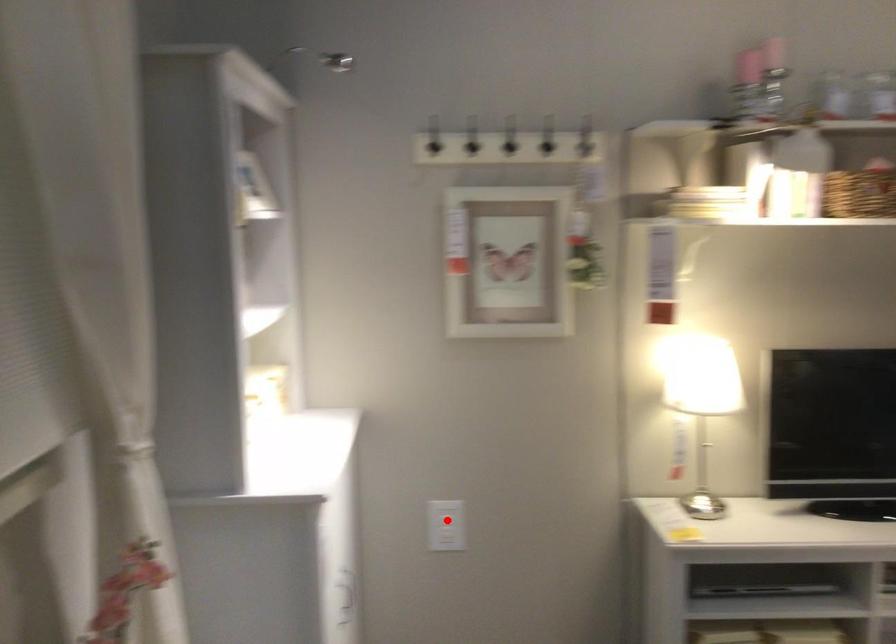
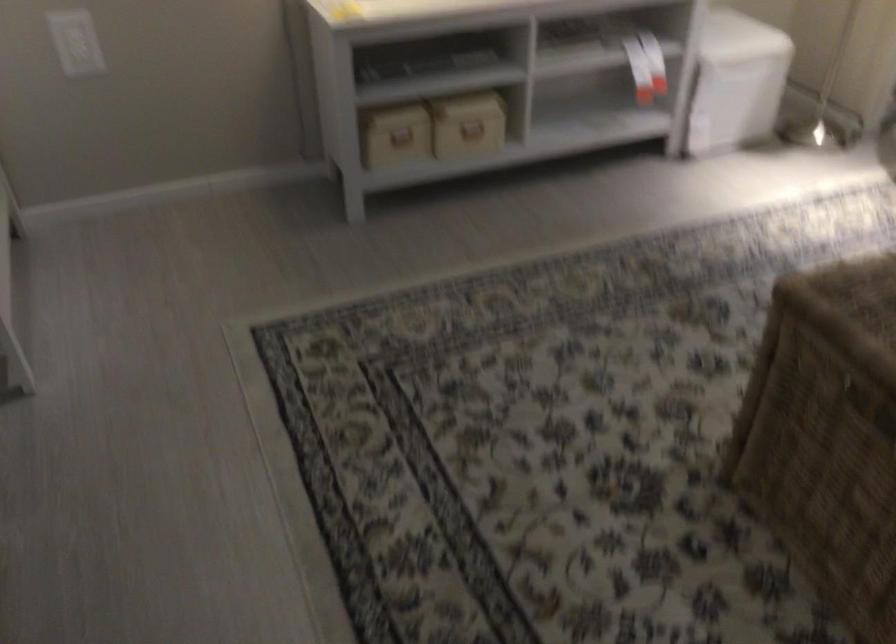
The point at the highlighted location is marked in the first image. Where is the corresponding point in the second image?

(75, 42)